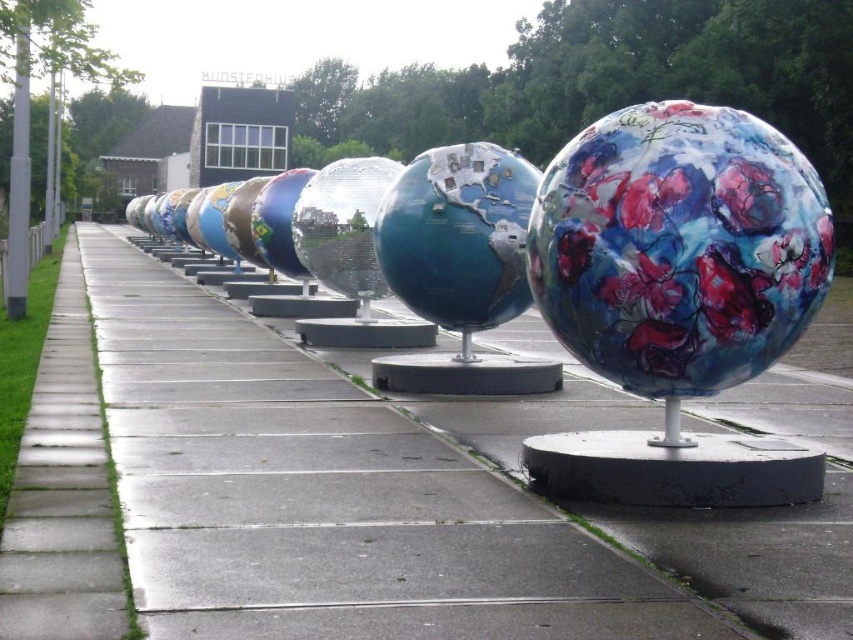
The height and width of the screenshot is (640, 853). What do you see at coordinates (340, 488) in the screenshot?
I see `concrete at center` at bounding box center [340, 488].

Is concrete at center shorter than floral painted sphere at center?

In fact, concrete at center may be taller than floral painted sphere at center.

Is point (764, 609) farther from camera compared to point (723, 358)?

No, it is not.

At what (x,y) coordinates should I click in order to perform the action: click on concrete at center. Please return your answer as a coordinate pair (x, y). Looking at the image, I should click on (340, 488).